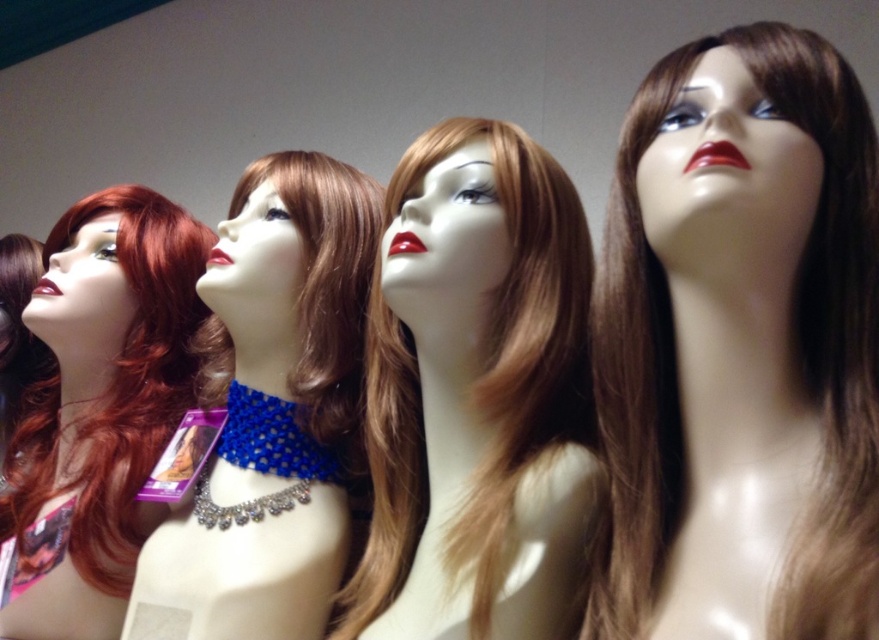
Question: Can you confirm if shiny brown wig at center is positioned above blue beaded necklace at center?

Choices:
 (A) no
 (B) yes

Answer: (B)

Question: Which point appears farthest from the camera in this image?

Choices:
 (A) (558, 429)
 (B) (59, 477)
 (C) (325, 259)
 (D) (816, 609)

Answer: (B)

Question: Considering the relative positions of brown shiny wig at center and blue beaded necklace at center in the image provided, where is brown shiny wig at center located with respect to blue beaded necklace at center?

Choices:
 (A) left
 (B) right

Answer: (B)

Question: Among these points, which one is farthest from the camera?

Choices:
 (A) (180, 221)
 (B) (249, 228)
 (C) (724, 499)
 (D) (495, 500)

Answer: (A)

Question: Which point is farther to the camera?

Choices:
 (A) (847, 570)
 (B) (469, 442)

Answer: (B)

Question: In this image, where is blue beaded necklace at center located relative to shiny red wig at left?

Choices:
 (A) above
 (B) below

Answer: (A)